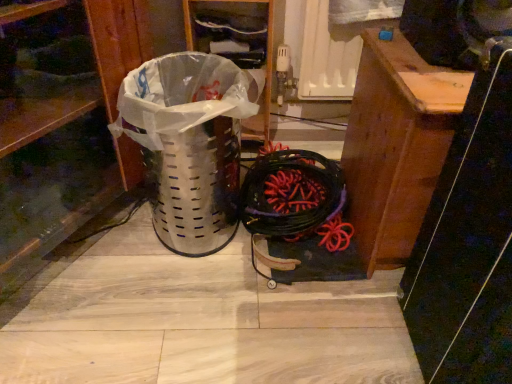
Question: Would you say black rubber battle rope at center is inside or outside wooden plank at center?

Choices:
 (A) inside
 (B) outside

Answer: (B)

Question: Relative to wooden plank at center, is black rubber battle rope at center in front or behind?

Choices:
 (A) behind
 (B) front

Answer: (A)

Question: Which of these objects is positioned closest to the black rubber battle rope at center?

Choices:
 (A) brushed metal trash can at left
 (B) metallic perforated trash can at left
 (C) wooden plank at center

Answer: (C)

Question: Considering the real-world distances, which object is farthest from the brushed metal trash can at left?

Choices:
 (A) metallic perforated trash can at left
 (B) black rubber battle rope at center
 (C) wooden plank at center

Answer: (C)